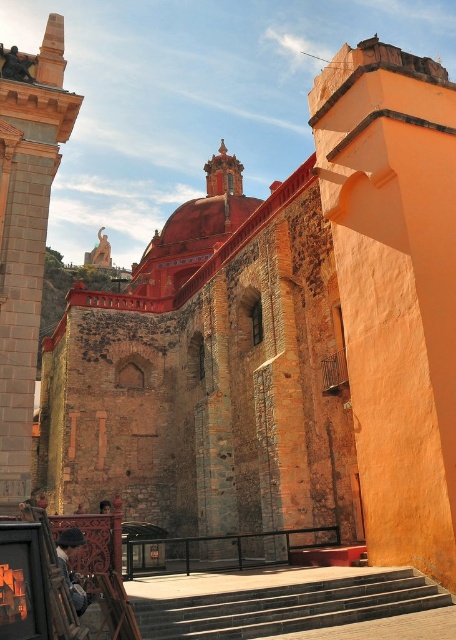
Question: Does smooth stone tower at left lie behind smooth stone stairs at center?

Choices:
 (A) no
 (B) yes

Answer: (B)

Question: Which of the following is the closest to the observer?

Choices:
 (A) smooth stone stairs at center
 (B) smooth stone tower at left

Answer: (A)

Question: Does smooth stone tower at left appear under smooth stone stairs at center?

Choices:
 (A) no
 (B) yes

Answer: (A)

Question: Among these objects, which one is farthest from the camera?

Choices:
 (A) smooth stone stairs at center
 (B) smooth stone tower at left

Answer: (B)

Question: Is smooth stone tower at left behind smooth stone stairs at center?

Choices:
 (A) yes
 (B) no

Answer: (A)